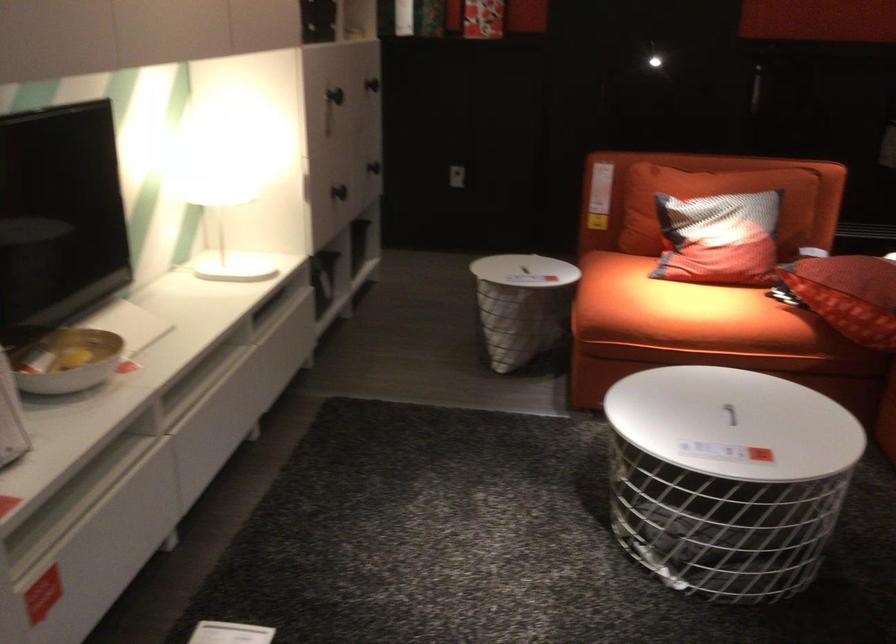
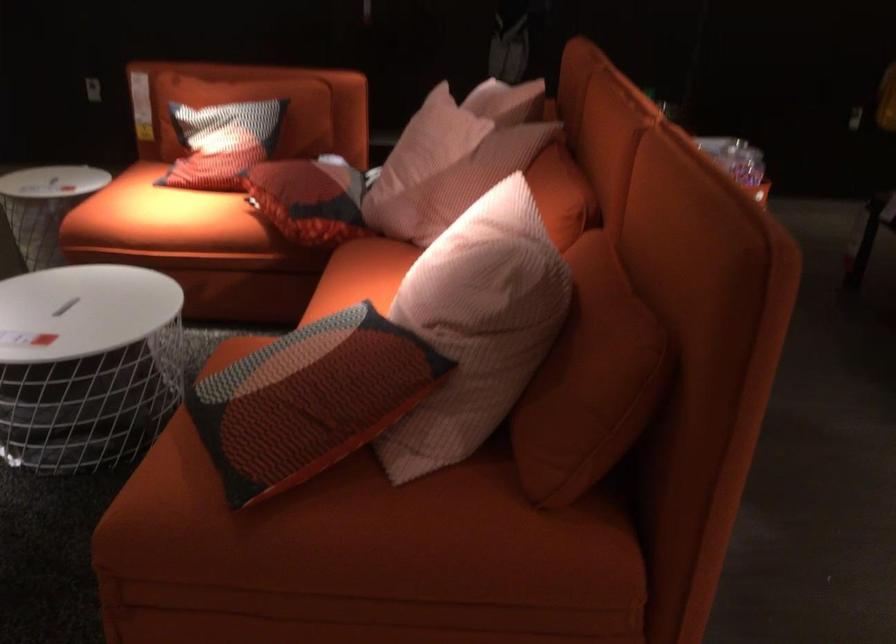
The point at (734, 227) is marked in the first image. Where is the corresponding point in the second image?

(222, 142)